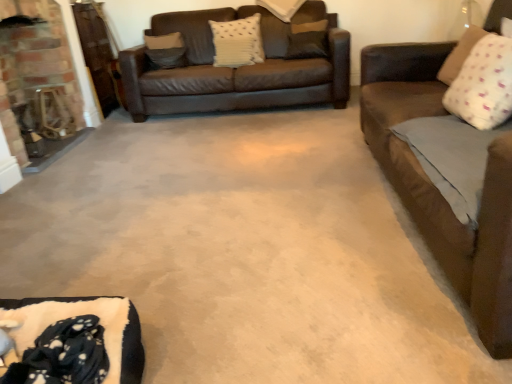
Question: Is brick fireplace at left closer to camera compared to brown fabric pillow at upper center, which appears as the third pillow when viewed from the right?

Choices:
 (A) no
 (B) yes

Answer: (B)

Question: Considering the relative positions of brick fireplace at left and brown fabric pillow at upper center, the fourth pillow when ordered from left to right, in the image provided, is brick fireplace at left to the right of brown fabric pillow at upper center, the fourth pillow when ordered from left to right, from the viewer's perspective?

Choices:
 (A) yes
 (B) no

Answer: (B)

Question: Is brick fireplace at left facing away from brown fabric pillow at upper center, which appears as the third pillow when viewed from the right?

Choices:
 (A) yes
 (B) no

Answer: (B)

Question: From the image's perspective, is brick fireplace at left below brown fabric pillow at upper center, which is counted as the 3th pillow, starting from the back?

Choices:
 (A) no
 (B) yes

Answer: (B)

Question: Could you tell me if brick fireplace at left is turned towards brown fabric pillow at upper center, which is counted as the 3th pillow, starting from the back?

Choices:
 (A) no
 (B) yes

Answer: (B)

Question: Is white textured pillow at upper center, the third pillow viewed from the left, bigger or smaller than white dotted pillow at upper right, the 6th pillow positioned from the left?

Choices:
 (A) big
 (B) small

Answer: (A)

Question: From the image's perspective, is white textured pillow at upper center, placed as the 5th pillow when sorted from front to back, positioned above or below white dotted pillow at upper right, the 6th pillow positioned from the left?

Choices:
 (A) above
 (B) below

Answer: (A)

Question: Considering their positions, is white textured pillow at upper center, the third pillow viewed from the left, located in front of or behind white dotted pillow at upper right, the 6th pillow positioned from the left?

Choices:
 (A) front
 (B) behind

Answer: (B)

Question: From a real-world perspective, is white textured pillow at upper center, the third pillow viewed from the left, positioned above or below white dotted pillow at upper right, the first pillow when ordered from right to left?

Choices:
 (A) above
 (B) below

Answer: (A)

Question: In terms of height, does brown fabric pillow at upper center, the fourth pillow when ordered from left to right, look taller or shorter compared to white textured pillow at center, the 5th pillow when ordered from right to left?

Choices:
 (A) tall
 (B) short

Answer: (B)

Question: From the image's perspective, is brown fabric pillow at upper center, which appears as the third pillow when viewed from the right, positioned above or below white textured pillow at center, the 3th pillow viewed from the front?

Choices:
 (A) above
 (B) below

Answer: (A)

Question: Looking at their shapes, would you say brown fabric pillow at upper center, which appears as the third pillow when viewed from the right, is wider or thinner than white textured pillow at center, positioned as the fourth pillow in back-to-front order?

Choices:
 (A) wide
 (B) thin

Answer: (A)

Question: Relative to white textured pillow at center, the 3th pillow viewed from the front, is brown fabric pillow at upper center, which appears as the third pillow when viewed from the right, in front or behind?

Choices:
 (A) behind
 (B) front

Answer: (A)

Question: Looking at the image, does brick fireplace at left seem bigger or smaller compared to white textured pillow at upper center, the fourth pillow viewed from the right?

Choices:
 (A) big
 (B) small

Answer: (A)

Question: Is brick fireplace at left situated inside white textured pillow at upper center, arranged as the 2th pillow when viewed from the back, or outside?

Choices:
 (A) outside
 (B) inside

Answer: (A)